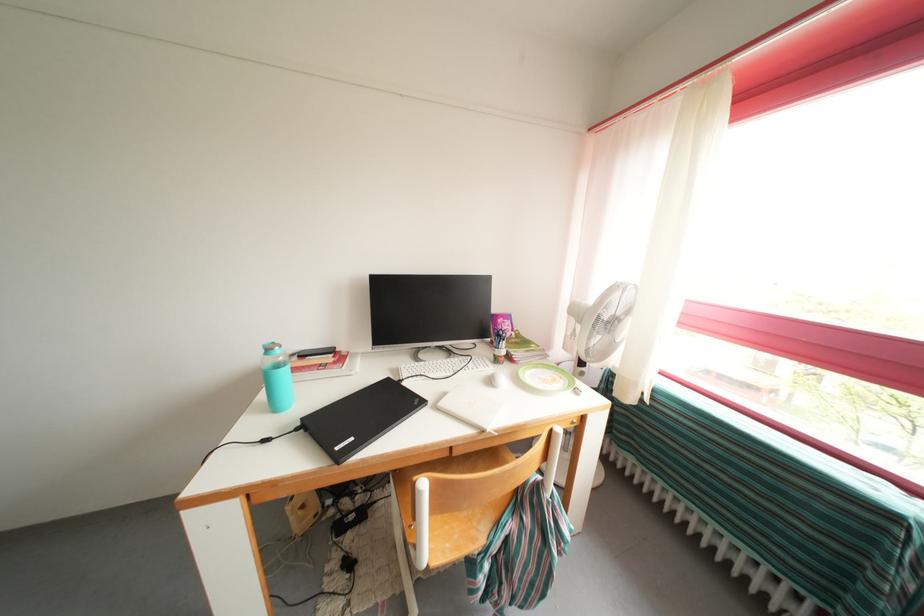
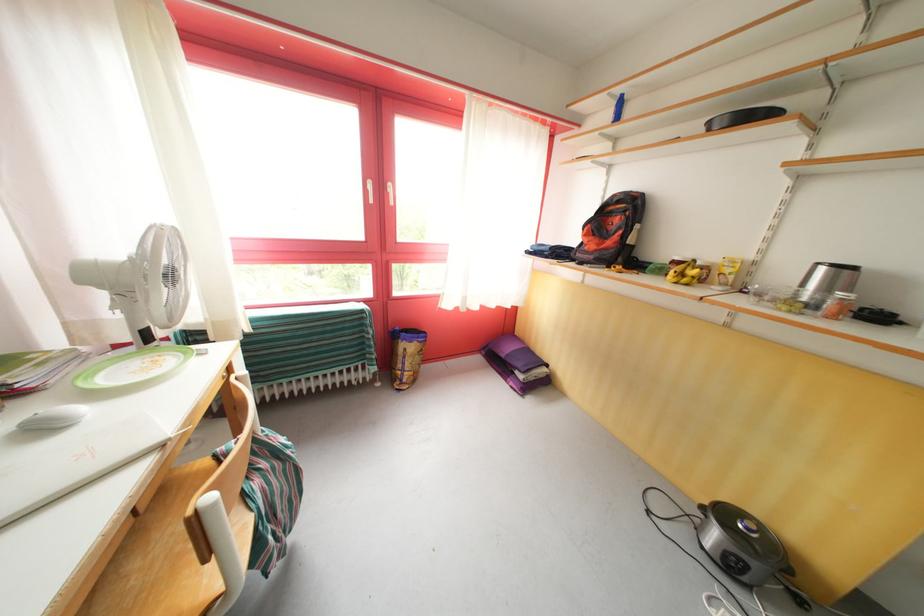
Find the pixel in the second image that matches point (554, 371) in the first image.

(128, 363)